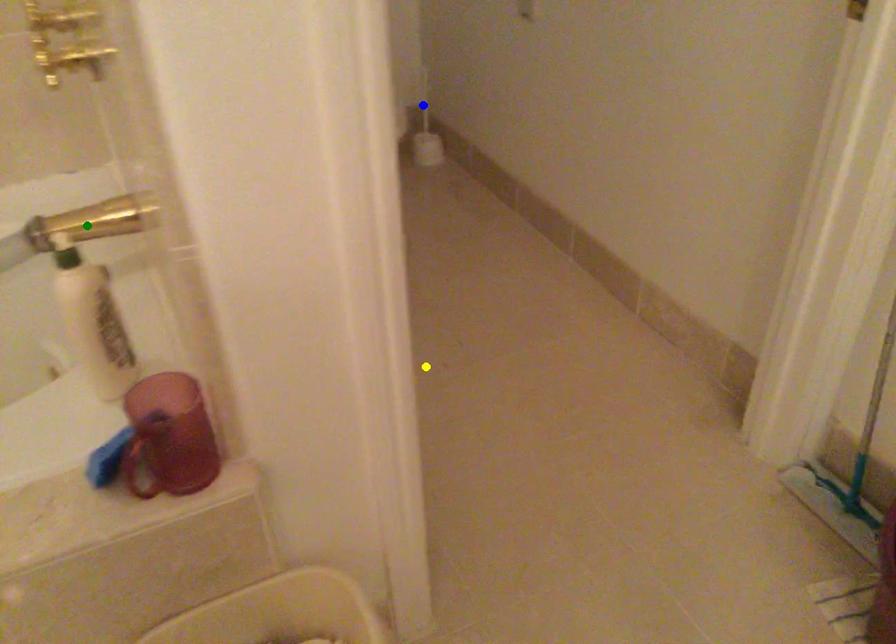
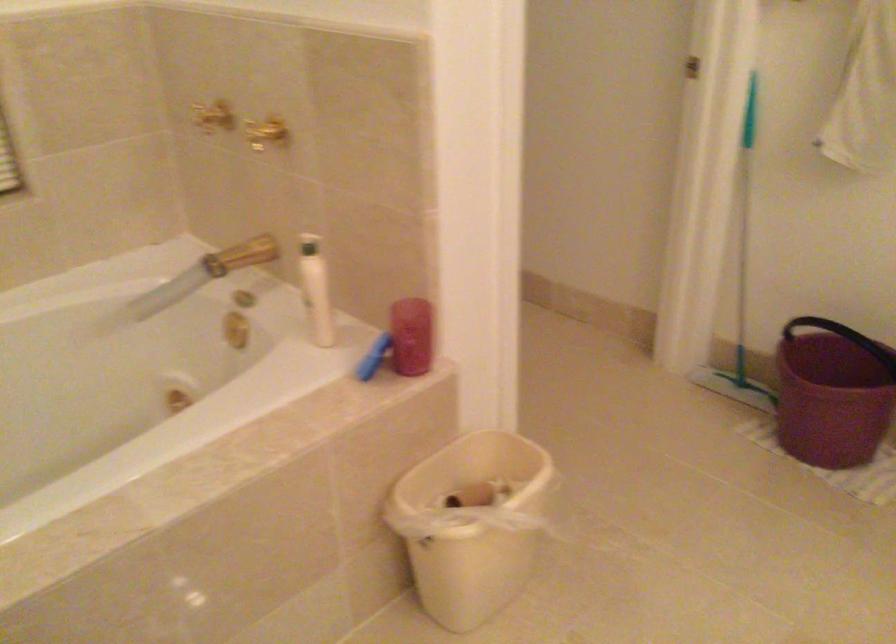
I am providing you with two images of the same scene from different viewpoints. Three points are marked in image1. Which point corresponds to a part or object that is occluded in image2?In image1, three points are marked. Which of them correspond to a part or object that is occluded in image2?Among the three points shown in image1, which one corresponds to a part or object that is no longer visible due to occlusion in image2?

yellow point, blue point